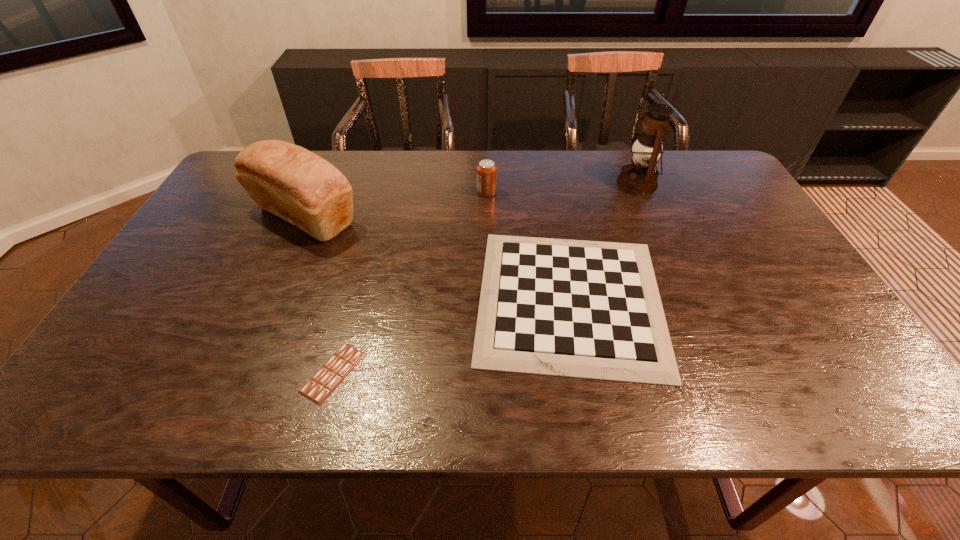
Where is `free space at the near edge`? The image size is (960, 540). free space at the near edge is located at coordinates (309, 409).

This screenshot has width=960, height=540. Identify the location of vacant space at the left edge of the desktop. (244, 199).

In the image, there is a desktop. What are the coordinates of `vacant space at the right edge` in the screenshot? It's located at (799, 339).

In the image, there is a desktop. Identify the location of vacant space at the far right corner. (692, 151).

Locate an element on the screen. This screenshot has width=960, height=540. blank area at the near right corner is located at coordinates (851, 390).

Locate an element on the screen. The width and height of the screenshot is (960, 540). free space between the fourth shortest object and the tallest object is located at coordinates (470, 200).

Identify the location of unoccupied position between the shortest object and the third shortest object. (410, 282).

Find the location of a particular element. The image size is (960, 540). vacant space in between the shortest object and the can is located at coordinates (410, 282).

The width and height of the screenshot is (960, 540). Identify the location of free space between the shortest object and the bread. (319, 295).

Find the location of a particular element. vacant space that is in between the second tallest object and the tallest object is located at coordinates (470, 200).